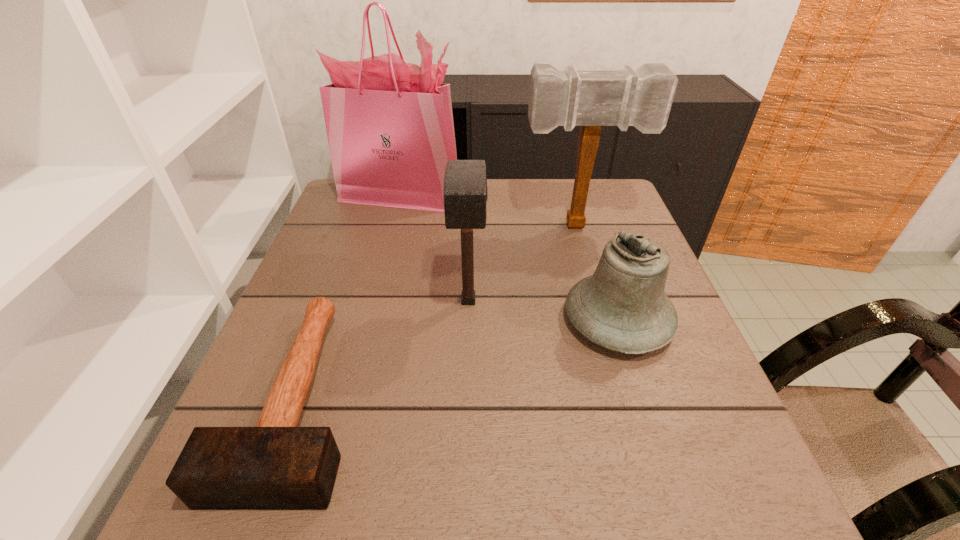
This screenshot has height=540, width=960. I want to click on free space that is in between the second mallet from left to right and the farthest object, so point(434,248).

This screenshot has height=540, width=960. What are the coordinates of `free space between the shopping bag and the third tallest object` in the screenshot? It's located at (434, 248).

You are a GUI agent. You are given a task and a screenshot of the screen. Output one action in this format:
    pyautogui.click(x=<x>, y=<y>)
    Task: Click on the free space between the tallest mallet and the farthest object
    This screenshot has width=960, height=540.
    Given the screenshot: What is the action you would take?
    pyautogui.click(x=489, y=210)

Locate an element on the screen. The height and width of the screenshot is (540, 960). free point between the bell and the second mallet from right to left is located at coordinates click(543, 310).

In order to click on free spot between the shortest mallet and the second tallest mallet in this screenshot , I will do `click(384, 348)`.

The image size is (960, 540). I want to click on free space between the shopping bag and the leftmost mallet, so click(349, 295).

Image resolution: width=960 pixels, height=540 pixels. I want to click on free spot between the fourth tallest object and the second mallet from right to left, so pyautogui.click(x=543, y=310).

This screenshot has height=540, width=960. In order to click on free area in between the shortest object and the third shortest object in this screenshot , I will do `click(384, 348)`.

Select which object is the second closest to the bell. Please provide its 2D coordinates. Your answer should be formatted as a tuple, i.e. [(x, y)], where the tuple contains the x and y coordinates of a point satisfying the conditions above.

[(642, 98)]

Locate which object ranks second in proximity to the tallest object. Please provide its 2D coordinates. Your answer should be formatted as a tuple, i.e. [(x, y)], where the tuple contains the x and y coordinates of a point satisfying the conditions above.

[(465, 192)]